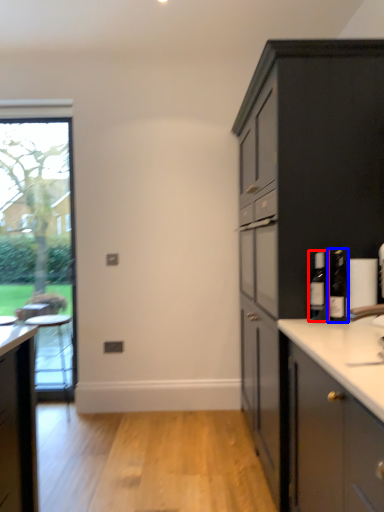
Question: Which object is further to the camera taking this photo, bottle (highlighted by a red box) or bottle (highlighted by a blue box)?

Choices:
 (A) bottle
 (B) bottle

Answer: (A)